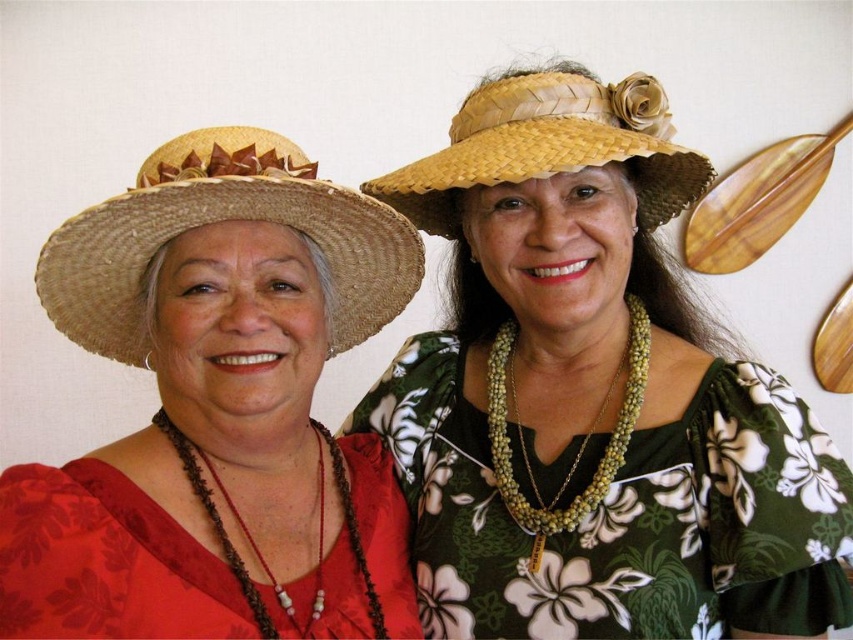
Question: Among these objects, which one is farthest from the camera?

Choices:
 (A) matte red fabric dress at lower left
 (B) matte straw hat at upper center
 (C) matte straw hat at upper left

Answer: (B)

Question: Is matte straw hat at upper left below woven straw hat at upper center?

Choices:
 (A) no
 (B) yes

Answer: (B)

Question: Does matte straw hat at upper center appear on the left side of matte red fabric dress at lower left?

Choices:
 (A) yes
 (B) no

Answer: (B)

Question: Estimate the real-world distances between objects in this image. Which object is farther from the matte straw hat at upper left?

Choices:
 (A) woven straw hat at upper center
 (B) matte straw hat at upper center
 (C) straw woven hat at left
 (D) matte red fabric dress at lower left

Answer: (A)

Question: Can you confirm if matte straw hat at upper center is positioned above straw woven hat at left?

Choices:
 (A) no
 (B) yes

Answer: (A)

Question: Which of these objects is positioned closest to the matte straw hat at upper center?

Choices:
 (A) straw woven hat at left
 (B) matte red fabric dress at lower left
 (C) matte straw hat at upper left
 (D) woven straw hat at upper center

Answer: (D)